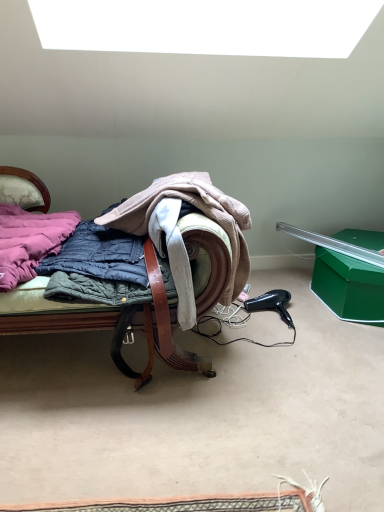
Locate an element on the screen. Image resolution: width=384 pixels, height=512 pixels. vacant area situated below black plastic hair dryer at lower right (from a real-world perspective) is located at coordinates (286, 314).